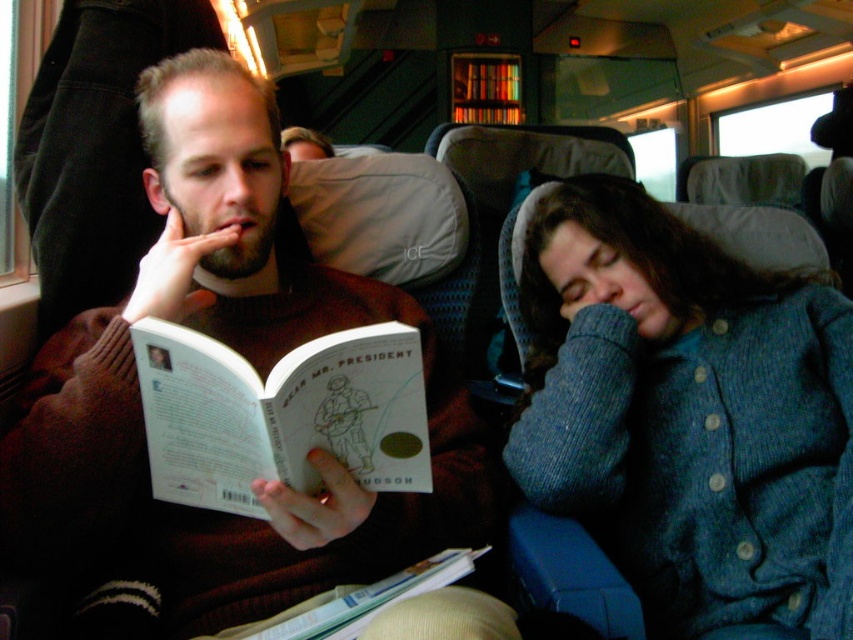
Question: Is knitted blue sweater at right positioned before hardcover book at center?

Choices:
 (A) no
 (B) yes

Answer: (A)

Question: From the image, what is the correct spatial relationship of brown sweater at left in relation to white paper at center?

Choices:
 (A) left
 (B) right

Answer: (A)

Question: Estimate the real-world distances between objects in this image. Which object is closer to the hardcover book at center?

Choices:
 (A) brown sweater at left
 (B) white paper at center
 (C) knitted blue sweater at right

Answer: (B)

Question: Which object appears closest to the camera in this image?

Choices:
 (A) knitted blue sweater at right
 (B) white paper at center

Answer: (B)

Question: Which object is the farthest from the knitted blue sweater at right?

Choices:
 (A) hardcover book at center
 (B) white paper at center
 (C) brown sweater at left

Answer: (B)

Question: Observing the image, what is the correct spatial positioning of knitted blue sweater at right in reference to white paper at center?

Choices:
 (A) right
 (B) left

Answer: (A)